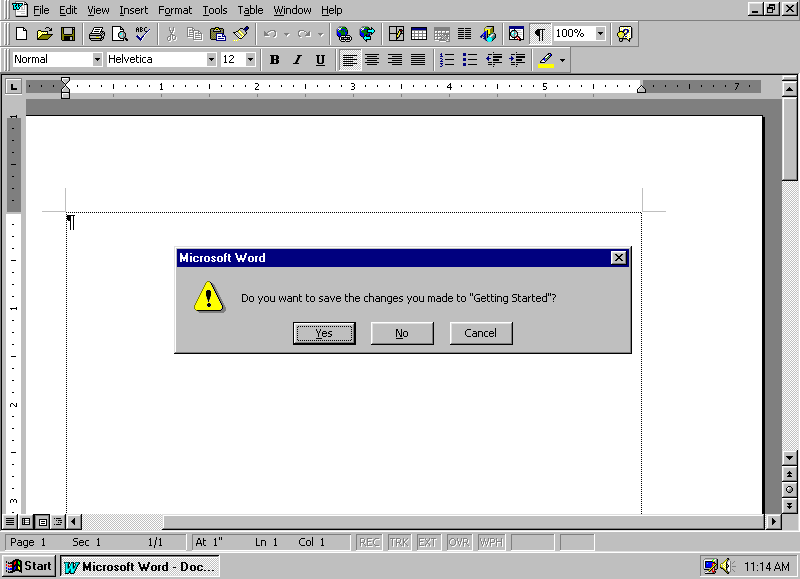
At what (x,y) coordinates should I click in order to perform the action: click on computer screen. Please return your answer as a coordinate pair (x, y). Looking at the image, I should click on (377, 266).